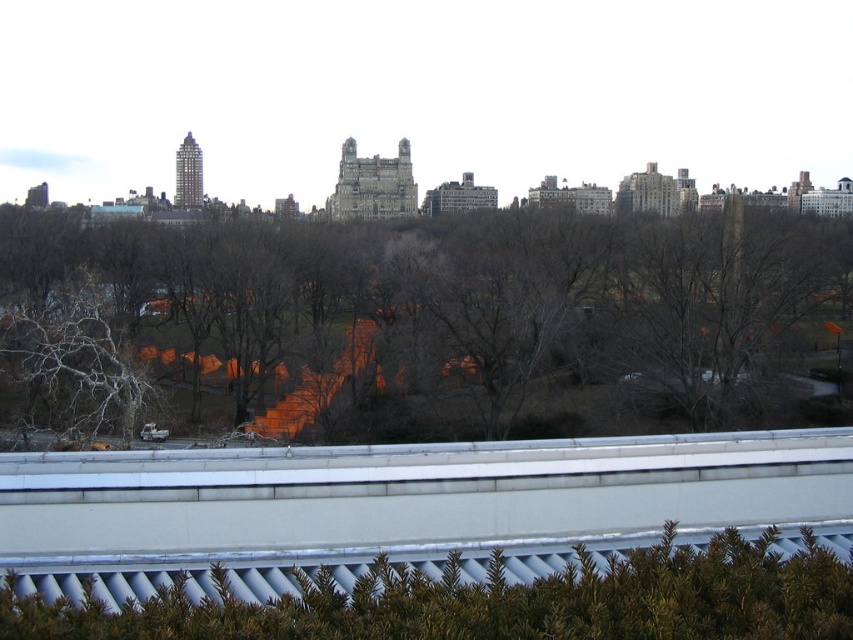
You are standing in the urban landscape scene and want to walk towards the brown leafless tree at center and the green textured hedge at lower center. Which object will you reach first?

You will reach the green textured hedge at lower center first because it is closer to you than the brown leafless tree at center, which is further away.

You are a city planner assessing the urban landscape. You need to determine if the brown leafless tree at center and the green textured hedge at lower center are within a 100 meter safety zone for pedestrian pathways. Are they within the required distance?

The distance between the brown leafless tree at center and the green textured hedge at lower center is 126.17 meters, which exceeds the 100 meter safety zone requirement. Therefore, they are not within the required distance.

You are standing at a point in the urban landscape scene. There are two points marked in the image. The first point is at coordinate (439,305) and the second is at (804,566). From your current position, which point is closer to you?

Point (804,566) is closer to you because it is in front of point (439,305) according to the spatial arrangement described.